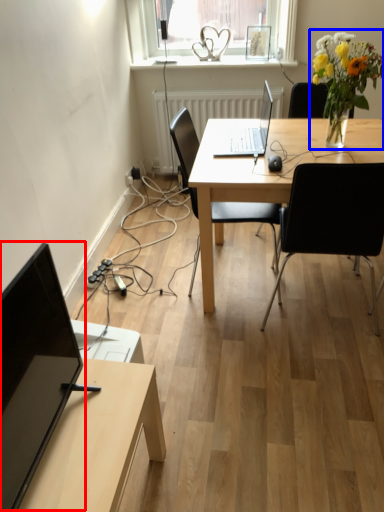
Question: Which object is closer to the camera taking this photo, computer monitor (highlighted by a red box) or floral arrangement (highlighted by a blue box)?

Choices:
 (A) computer monitor
 (B) floral arrangement

Answer: (A)